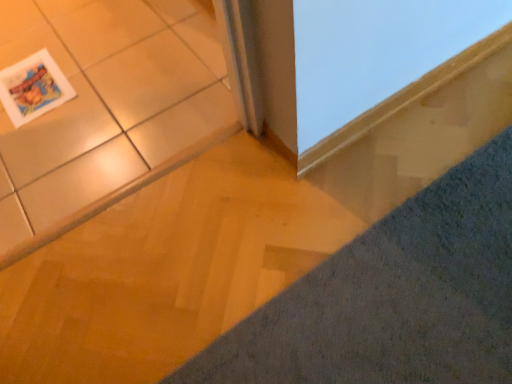
Question: Looking at the image, does matte paper magazine at upper left seem bigger or smaller compared to gray textured carpet at lower right?

Choices:
 (A) big
 (B) small

Answer: (B)

Question: Based on their positions, is matte paper magazine at upper left located to the left or right of gray textured carpet at lower right?

Choices:
 (A) left
 (B) right

Answer: (A)

Question: Based on their relative distances, which object is nearer to the matte ceramic tile at upper left?

Choices:
 (A) matte paper magazine at upper left
 (B) gray textured carpet at lower right
 (C) smooth wood frame at upper right

Answer: (A)

Question: Based on their relative distances, which object is nearer to the gray textured carpet at lower right?

Choices:
 (A) smooth wood frame at upper right
 (B) matte ceramic tile at upper left
 (C) matte paper magazine at upper left

Answer: (A)